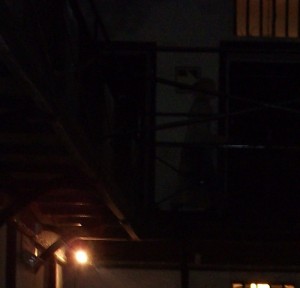
Find the location of a particular element. This screenshot has height=288, width=300. upper floor is located at coordinates (75, 127), (196, 219).